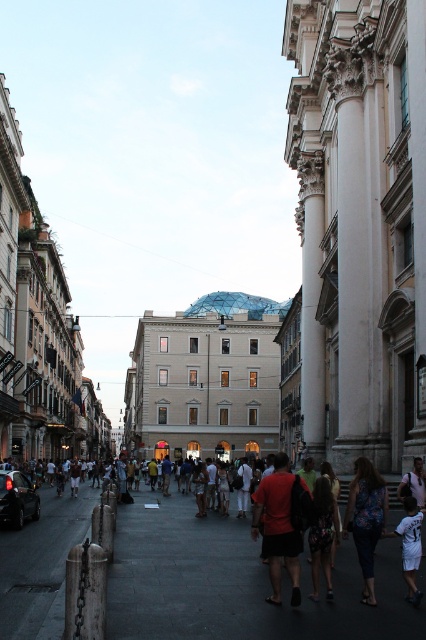
Question: Is matte black crowd at center to the right of shiny black car at lower left from the viewer's perspective?

Choices:
 (A) no
 (B) yes

Answer: (B)

Question: Observing the image, what is the correct spatial positioning of shiny black car at lower left in reference to light brown leather backpack at lower right?

Choices:
 (A) right
 (B) left

Answer: (B)

Question: Which of the following is the farthest from the observer?

Choices:
 (A) (417, 504)
 (B) (279, 486)
 (C) (373, 499)

Answer: (B)

Question: Which is farther from the matte black crowd at center?

Choices:
 (A) shiny black car at lower left
 (B) floral-patterned fabric at center-right

Answer: (B)

Question: Is the position of matte black crowd at center more distant than that of floral-patterned fabric at center-right?

Choices:
 (A) no
 (B) yes

Answer: (A)

Question: Which point is farther to the camera?

Choices:
 (A) floral-patterned fabric at center-right
 (B) light brown leather backpack at lower right
 (C) matte black crowd at center
 (D) white cotton shirt at lower right

Answer: (B)